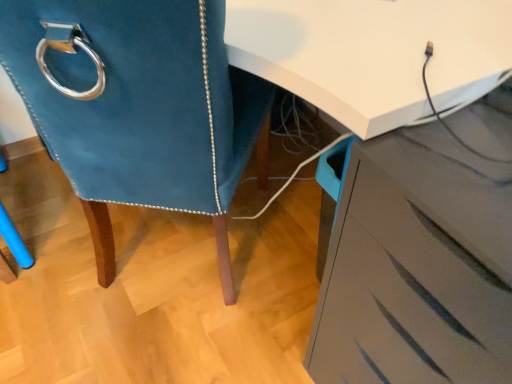
This screenshot has height=384, width=512. Identify the location of matte gray chest of drawers at lower right. (416, 269).

Image resolution: width=512 pixels, height=384 pixels. Describe the element at coordinates (416, 269) in the screenshot. I see `matte gray chest of drawers at lower right` at that location.

In order to face matte gray chest of drawers at lower right, should I rotate leftwards or rightwards?

To align with it, rotate right about 29.060°.

Measure the distance between point (223,124) and camera.

Point (223,124) is 29.61 inches away from camera.

Image resolution: width=512 pixels, height=384 pixels. Describe the element at coordinates (143, 110) in the screenshot. I see `velvet blue chair at left` at that location.

Identify the location of velvet blue chair at left. This screenshot has height=384, width=512. (143, 110).

Where is `matte gray chest of drawers at lower right`? matte gray chest of drawers at lower right is located at coordinates (416, 269).

Visually, is matte gray chest of drawers at lower right positioned to the left or to the right of velvet blue chair at left?

Based on their positions, matte gray chest of drawers at lower right is located to the right of velvet blue chair at left.

In the image, is matte gray chest of drawers at lower right positioned in front of or behind velvet blue chair at left?

Visually, matte gray chest of drawers at lower right is located in front of velvet blue chair at left.

Is point (372, 327) farther from viewer compared to point (138, 93)?

Yes, it is.

From the image's perspective, is matte gray chest of drawers at lower right above velvet blue chair at left?

Actually, matte gray chest of drawers at lower right appears below velvet blue chair at left in the image.

From a real-world perspective, which is physically above, matte gray chest of drawers at lower right or velvet blue chair at left?

In real-world perspective, velvet blue chair at left is above.

Considering the sizes of matte gray chest of drawers at lower right and velvet blue chair at left in the image, is matte gray chest of drawers at lower right wider or thinner than velvet blue chair at left?

Clearly, matte gray chest of drawers at lower right has less width compared to velvet blue chair at left.

Considering the relative sizes of matte gray chest of drawers at lower right and velvet blue chair at left in the image provided, is matte gray chest of drawers at lower right taller than velvet blue chair at left?

Incorrect, the height of matte gray chest of drawers at lower right is not larger of that of velvet blue chair at left.

Can you confirm if matte gray chest of drawers at lower right is bigger than velvet blue chair at left?

No, matte gray chest of drawers at lower right is not bigger than velvet blue chair at left.

Would you say velvet blue chair at left is part of matte gray chest of drawers at lower right's contents?

No, velvet blue chair at left is not inside matte gray chest of drawers at lower right.

Is matte gray chest of drawers at lower right far from velvet blue chair at left?

They are positioned close to each other.

Is velvet blue chair at left at the back of matte gray chest of drawers at lower right?

That's not correct — matte gray chest of drawers at lower right is not looking away from velvet blue chair at left.

Measure the distance between matte gray chest of drawers at lower right and velvet blue chair at left.

They are 15.43 inches apart.

Find the location of a particular element. The height and width of the screenshot is (384, 512). chest of drawers in front of the velvet blue chair at left is located at coordinates (416, 269).

Would you say velvet blue chair at left is to the left or to the right of matte gray chest of drawers at lower right in the picture?

From the image, it's evident that velvet blue chair at left is to the left of matte gray chest of drawers at lower right.

Is velvet blue chair at left further to camera compared to matte gray chest of drawers at lower right?

Yes, velvet blue chair at left is behind matte gray chest of drawers at lower right.

Between point (170, 151) and point (488, 168), which one is positioned in front?

The point (488, 168) is more forward.

From the image's perspective, relative to matte gray chest of drawers at lower right, is velvet blue chair at left above or below?

velvet blue chair at left is above matte gray chest of drawers at lower right.

From a real-world perspective, who is located higher, velvet blue chair at left or matte gray chest of drawers at lower right?

In real-world perspective, velvet blue chair at left is above.

Can you confirm if velvet blue chair at left is wider than matte gray chest of drawers at lower right?

Indeed, velvet blue chair at left has a greater width compared to matte gray chest of drawers at lower right.

Considering the sizes of objects velvet blue chair at left and matte gray chest of drawers at lower right in the image provided, who is shorter, velvet blue chair at left or matte gray chest of drawers at lower right?

matte gray chest of drawers at lower right.

Does velvet blue chair at left have a larger size compared to matte gray chest of drawers at lower right?

Yes, velvet blue chair at left is bigger than matte gray chest of drawers at lower right.

Would you say velvet blue chair at left is inside or outside matte gray chest of drawers at lower right?

velvet blue chair at left is not enclosed by matte gray chest of drawers at lower right.

Is velvet blue chair at left far away from matte gray chest of drawers at lower right?

velvet blue chair at left is near matte gray chest of drawers at lower right, not far away.

Consider the image. Is velvet blue chair at left aimed at matte gray chest of drawers at lower right?

No, velvet blue chair at left is not turned towards matte gray chest of drawers at lower right.

How many degrees apart are the facing directions of velvet blue chair at left and matte gray chest of drawers at lower right?

132 degrees.

Find the location of a particular element. This screenshot has height=384, width=512. the chest of drawers below the velvet blue chair at left (from the image's perspective) is located at coordinates (416, 269).

Image resolution: width=512 pixels, height=384 pixels. I want to click on furniture to the left of matte gray chest of drawers at lower right, so click(143, 110).

Where is `furniture above the matte gray chest of drawers at lower right (from a real-world perspective)`? This screenshot has width=512, height=384. furniture above the matte gray chest of drawers at lower right (from a real-world perspective) is located at coordinates (143, 110).